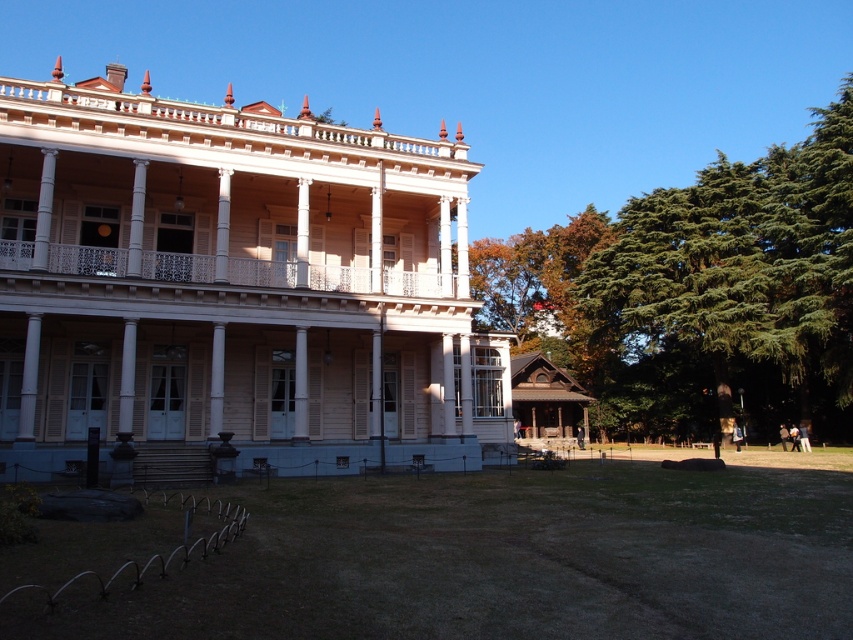
Does light beige wood mansion at center have a larger size compared to green grass at lower center?

Yes.

From the picture: Is light beige wood mansion at center to the left of green grass at lower center from the viewer's perspective?

Yes, light beige wood mansion at center is to the left of green grass at lower center.

Is point (16, 301) positioned behind point (807, 579)?

Yes, it is.

This screenshot has height=640, width=853. I want to click on light beige wood mansion at center, so pos(233,288).

Is point (437, 381) less distant than point (389, 289)?

No.

Is light beige wood mansion at center below white painted wood porch at center?

No, light beige wood mansion at center is not below white painted wood porch at center.

Which is in front, point (282, 448) or point (444, 280)?

Point (282, 448)

Locate an element on the screen. This screenshot has width=853, height=640. light beige wood mansion at center is located at coordinates (233, 288).

The image size is (853, 640). What do you see at coordinates (503, 561) in the screenshot?
I see `green grass at lower center` at bounding box center [503, 561].

Does green grass at lower center appear over white painted wood porch at center?

No, green grass at lower center is not above white painted wood porch at center.

The width and height of the screenshot is (853, 640). Describe the element at coordinates (503, 561) in the screenshot. I see `green grass at lower center` at that location.

Find the location of a particular element. The image size is (853, 640). green grass at lower center is located at coordinates (503, 561).